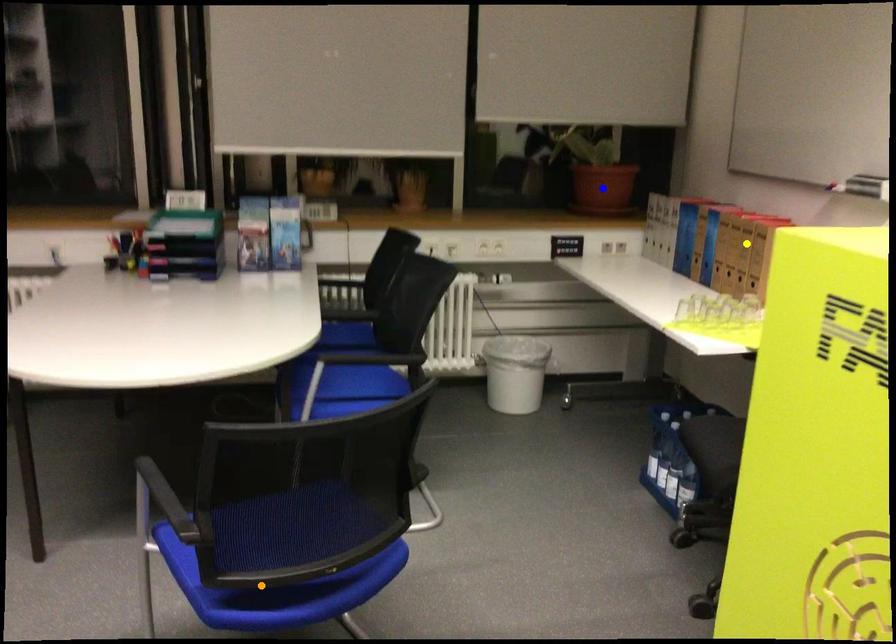
Order these from nearest to farthest:
blue point, yellow point, orange point

blue point
yellow point
orange point